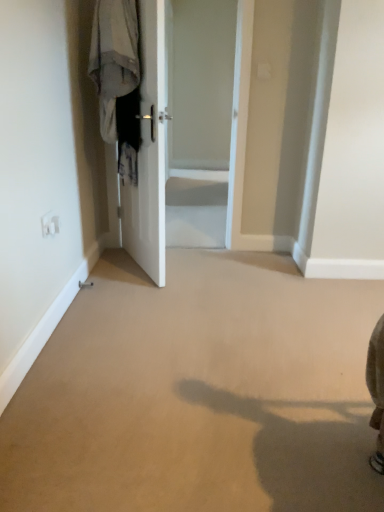
Question: Does point tap(110, 128) appear closer or farther from the camera than point tap(148, 202)?

Choices:
 (A) farther
 (B) closer

Answer: (B)

Question: Considering the positions of light gray fabric at left and white glossy door at center in the image, is light gray fabric at left bigger or smaller than white glossy door at center?

Choices:
 (A) big
 (B) small

Answer: (B)

Question: Which is nearer to the light gray fabric at left?

Choices:
 (A) white glossy door at center
 (B) white glossy door at center

Answer: (B)

Question: Based on their relative distances, which object is farther from the light gray fabric at left?

Choices:
 (A) white glossy door at center
 (B) white glossy door at center

Answer: (A)